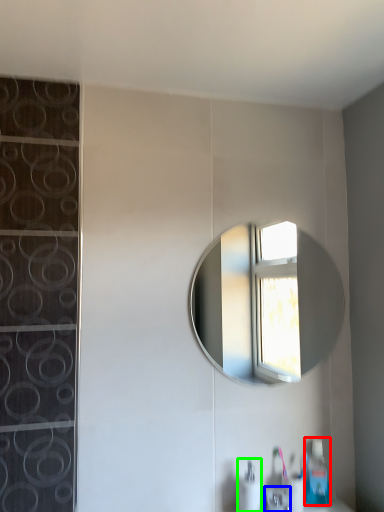
Question: Which object is positioned farthest from soap dispenser (highlighted by a red box)? Select from faucet (highlighted by a blue box) and soap dispenser (highlighted by a green box).

Choices:
 (A) faucet
 (B) soap dispenser

Answer: (B)